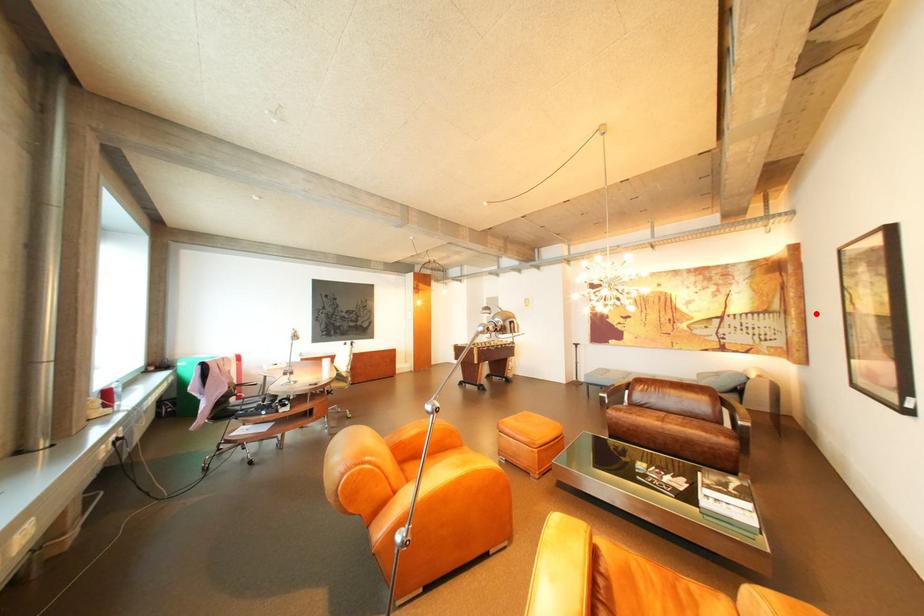
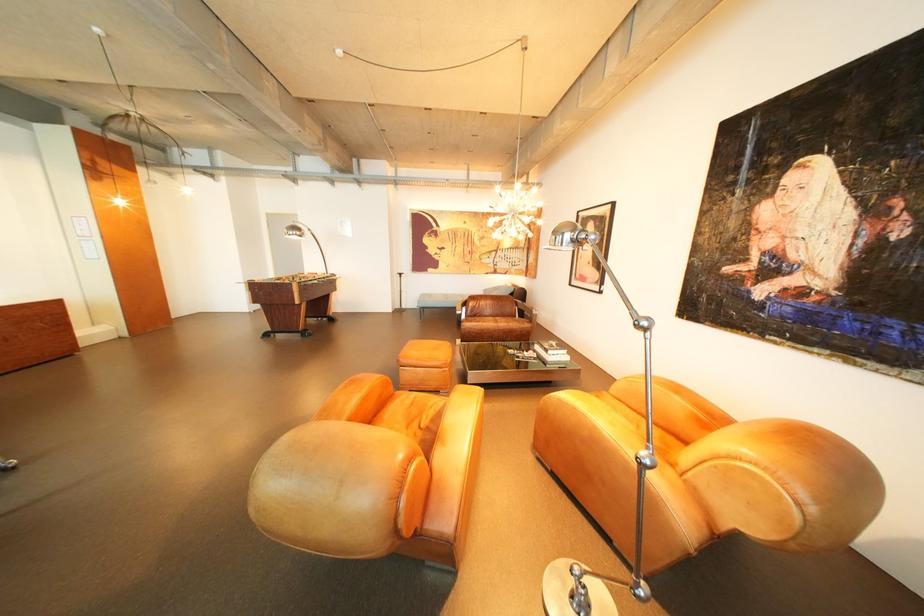
Question: I am providing you with two images of the same scene from different viewpoints. Image1 has a red point marked. In image2, the corresponding 3D location appears at what relative position? Reply with the corresponding letter.

Choices:
 (A) Closer
 (B) Farther

Answer: (A)